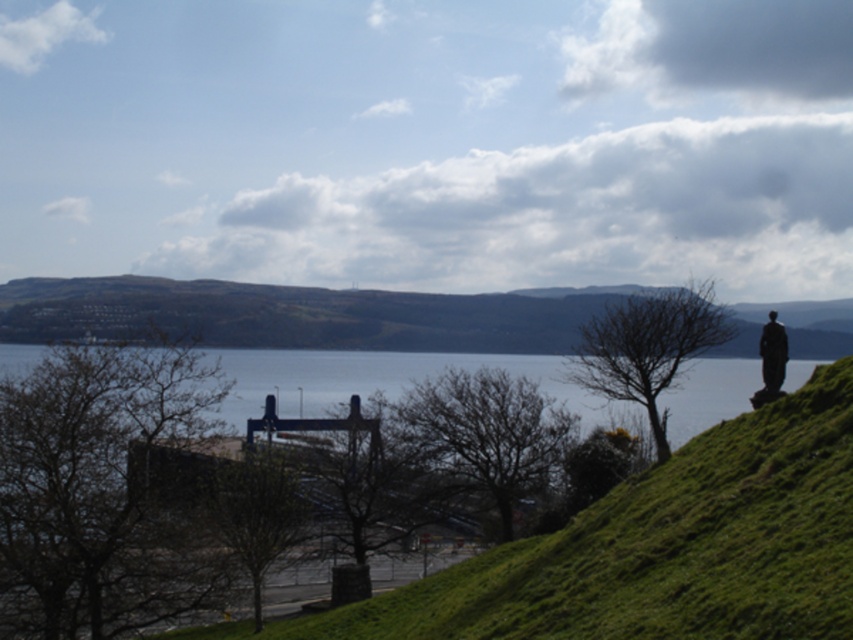
You are standing at the statue on the right side of the image and want to walk to the pier or dock in the middle ground. There are two points marked on your path. Which point, point 1 at coordinates (608, 321) or point 2 at coordinates (759, 342), is closer to you as you start walking towards the pier?

Point 1 at coordinates (608, 321) is closer to you because it is further to the viewer than point 2 at coordinates (759, 342), meaning it lies along your path closer to your starting position at the statue.

Looking at this image, you are a hiker standing on the grassy slope in the foreground of the image. You see the bare branches at center and the bare wood tree at center. Which one is closer to the ground?

The bare branches at center is below bare wood tree at center, so it is closer to the ground.